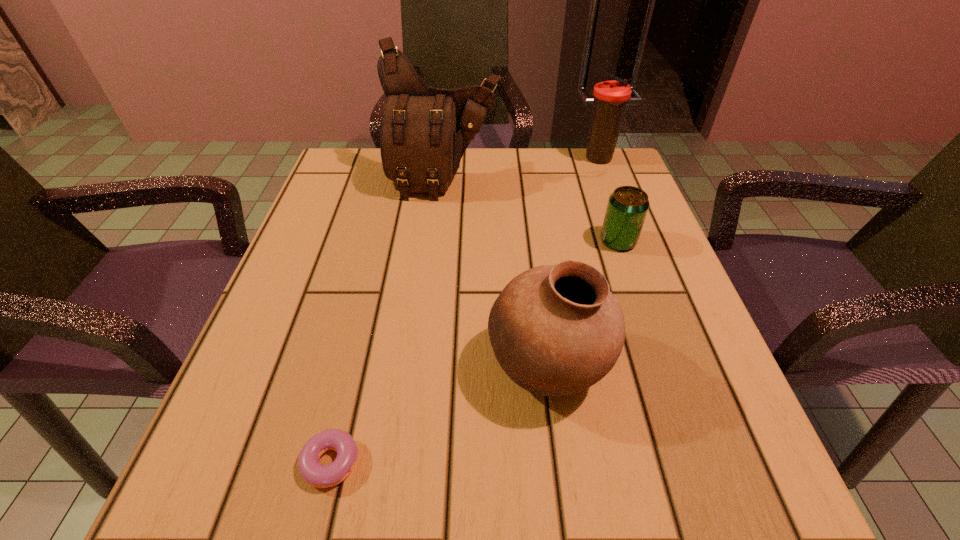
Find the location of a particular element. This screenshot has width=960, height=540. object that is at the near left corner is located at coordinates (315, 474).

What are the coordinates of `object that is at the far right corner` in the screenshot? It's located at (611, 97).

In the image, there is a desktop. Where is `free space at the far edge`? The image size is (960, 540). free space at the far edge is located at coordinates (516, 179).

Find the location of `free space at the near edge of the desktop`. free space at the near edge of the desktop is located at coordinates (357, 490).

What are the coordinates of `vacant space at the left edge` in the screenshot? It's located at (345, 225).

Locate an element on the screen. This screenshot has width=960, height=540. vacant point at the right edge is located at coordinates (660, 350).

Where is `vacant space at the far left corner of the desktop`? vacant space at the far left corner of the desktop is located at coordinates (374, 152).

At what (x,y) coordinates should I click in order to perform the action: click on vacant space at the far right corner of the desktop. Please return your answer as a coordinate pair (x, y). The height and width of the screenshot is (540, 960). Looking at the image, I should click on (600, 178).

In the image, there is a desktop. Find the location of `free region at the near right corner`. free region at the near right corner is located at coordinates (791, 523).

The width and height of the screenshot is (960, 540). In order to click on free spot between the fourth tallest object and the nearest object in this screenshot , I will do `click(471, 352)`.